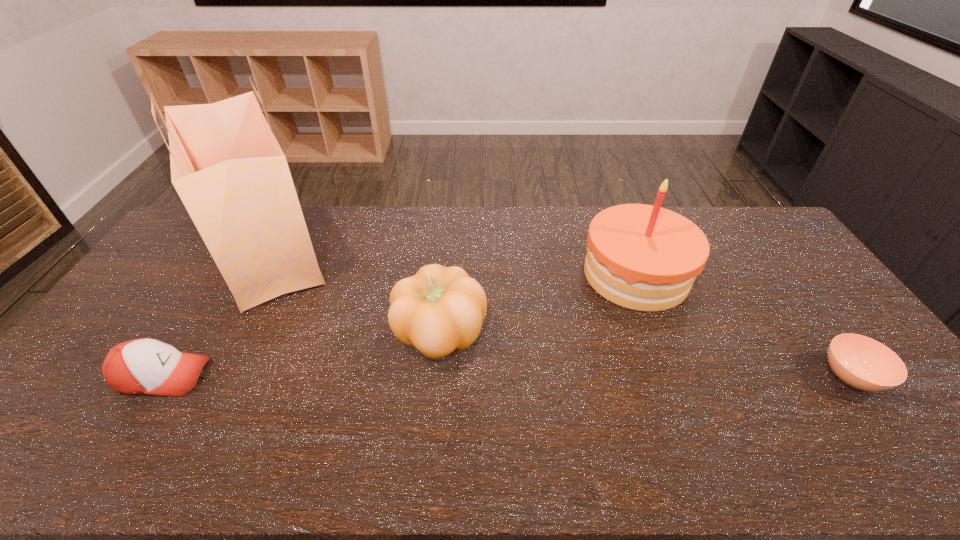
At what (x,y) coordinates should I click in order to perform the action: click on vacant position in the image that satisfies the following two spatial constraints: 1. on the front side of the third object from right to left; 2. on the front-facing side of the baseball cap. Please return your answer as a coordinate pair (x, y). The height and width of the screenshot is (540, 960). Looking at the image, I should click on (436, 376).

This screenshot has height=540, width=960. In order to click on vacant area that satisfies the following two spatial constraints: 1. on the back side of the pumpkin; 2. on the side of the grocery bag with the superhero design in this screenshot , I will do `click(446, 254)`.

Identify the location of vacant space that satisfies the following two spatial constraints: 1. on the front-facing side of the baseball cap; 2. on the back side of the soup bowl. (163, 377).